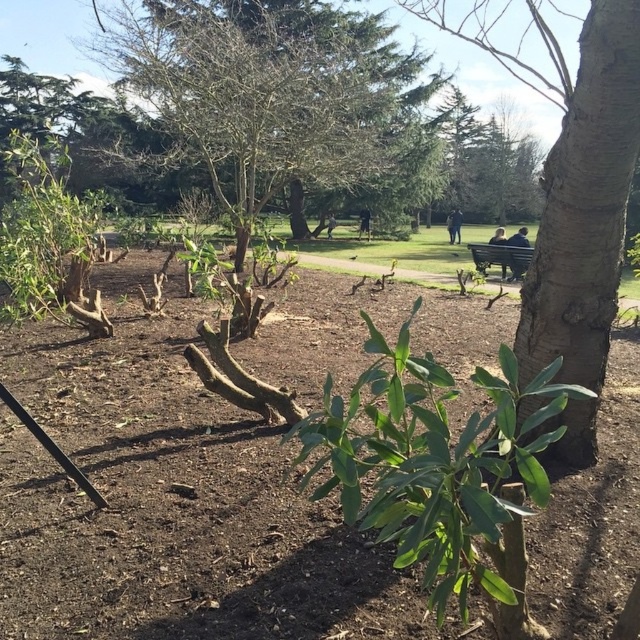
Can you confirm if brown soil at center is positioned below green leafy shrub at center?

Correct, brown soil at center is located below green leafy shrub at center.

Between brown soil at center and green leafy shrub at center, which one appears on the left side from the viewer's perspective?

brown soil at center

In order to click on brown soil at center in this screenshot , I will do `click(166, 499)`.

Which is above, brown soil at center or bare wood tree at center?

bare wood tree at center is higher up.

Between point (632, 548) and point (410, 84), which one is positioned behind?

The point (410, 84) is behind.

Identify the location of brown soil at center. (166, 499).

Image resolution: width=640 pixels, height=640 pixels. Find the location of `brown soil at center`. brown soil at center is located at coordinates (166, 499).

Does brown soil at center lie in front of wooden bench at center?

Yes, it is in front of wooden bench at center.

Who is taller, brown soil at center or wooden bench at center?

Standing taller between the two is wooden bench at center.

Identify the location of brown soil at center. This screenshot has width=640, height=640. (166, 499).